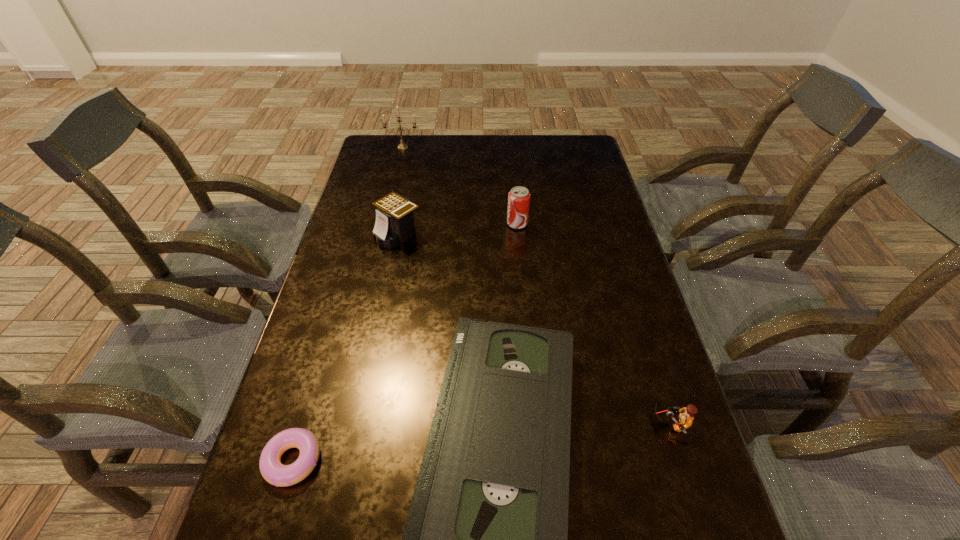
In order to click on free space at the left edge of the desktop in this screenshot , I will do `click(258, 483)`.

This screenshot has height=540, width=960. I want to click on blank space at the right edge of the desktop, so click(x=621, y=325).

This screenshot has width=960, height=540. I want to click on free space at the far right corner of the desktop, so click(562, 158).

In order to click on vacant space in between the Lego and the candle in this screenshot , I will do 537,285.

Where is `free point between the doughnut and the fourth shortest object`? The height and width of the screenshot is (540, 960). free point between the doughnut and the fourth shortest object is located at coordinates (346, 347).

Find the location of a particular element. The width and height of the screenshot is (960, 540). vacant point located between the Lego and the fifth shortest object is located at coordinates (594, 323).

What are the coordinates of `free point between the doughnut and the fourth shortest object` in the screenshot? It's located at (346, 347).

Image resolution: width=960 pixels, height=540 pixels. I want to click on free point between the farthest object and the fourth shortest object, so click(x=400, y=190).

The image size is (960, 540). Find the location of `unoccupied position between the doughnut and the farthest object`. unoccupied position between the doughnut and the farthest object is located at coordinates (348, 303).

Select which object appears as the fourth closest to the rightmost object. Please provide its 2D coordinates. Your answer should be formatted as a tuple, i.e. [(x, y)], where the tuple contains the x and y coordinates of a point satisfying the conditions above.

[(394, 224)]